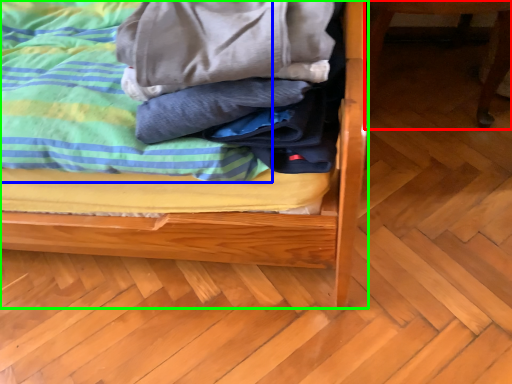
Question: Based on their relative distances, which object is farther from furniture (highlighted by a red box)? Choose from blanket (highlighted by a blue box) and bed (highlighted by a green box).

Choices:
 (A) blanket
 (B) bed

Answer: (A)